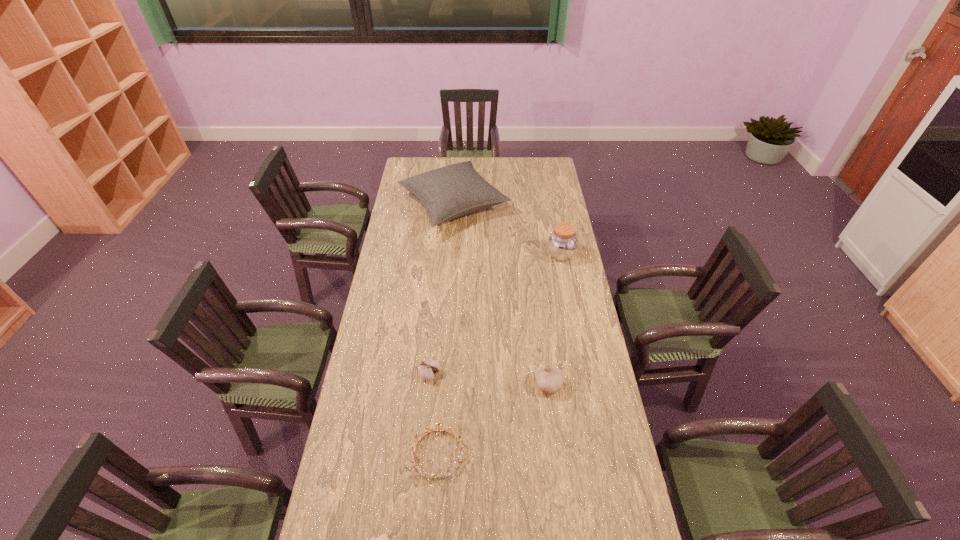
Where is `vacant region at the right edge`? vacant region at the right edge is located at coordinates (546, 256).

Find the location of `free spot at the far left corner of the desktop`. free spot at the far left corner of the desktop is located at coordinates (425, 159).

Image resolution: width=960 pixels, height=540 pixels. In order to click on free space at the far right corner of the desktop in this screenshot , I will do `click(533, 176)`.

The width and height of the screenshot is (960, 540). I want to click on vacant space in between the second nearest object and the second object from right to left, so click(x=493, y=419).

Where is `vacant point located between the left garlic and the jar`? vacant point located between the left garlic and the jar is located at coordinates (495, 314).

You are a GUI agent. You are given a task and a screenshot of the screen. Output one action in this format:
    pyautogui.click(x=<x>, y=<y>)
    Task: Click on the empty location between the second object from right to left and the second tallest object
    
    Given the screenshot: What is the action you would take?
    pyautogui.click(x=555, y=319)

Locate an element on the screen. vacant area that lies between the tallest object and the second shortest object is located at coordinates (445, 330).

Find the location of `vacant area between the left garlic and the farthest object`. vacant area between the left garlic and the farthest object is located at coordinates (442, 289).

Identify the location of the fourth closest object relative to the tiara. The width and height of the screenshot is (960, 540). (562, 243).

Identify the location of the fourth closest object to the second shortest object. (562, 243).